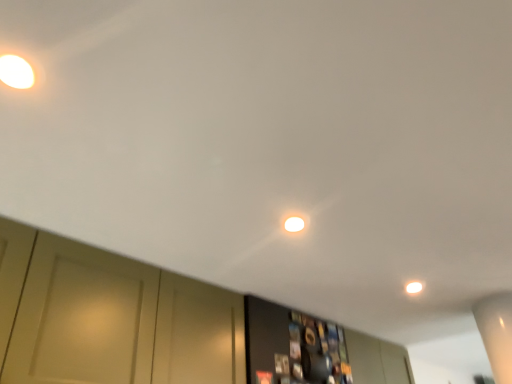
This screenshot has height=384, width=512. What do you see at coordinates (294, 222) in the screenshot?
I see `white glossy light fixture at center` at bounding box center [294, 222].

You are a GUI agent. You are given a task and a screenshot of the screen. Output one action in this format:
    pyautogui.click(x=<x>, y=<y>)
    Task: Click on the white glossy light fixture at center
    This screenshot has width=512, height=384.
    Given the screenshot: What is the action you would take?
    pyautogui.click(x=294, y=222)

Measure the distance between point (286, 214) and camera.

Result: Point (286, 214) and camera are 1.19 meters apart.

Identify the location of white glossy light fixture at center. (294, 222).